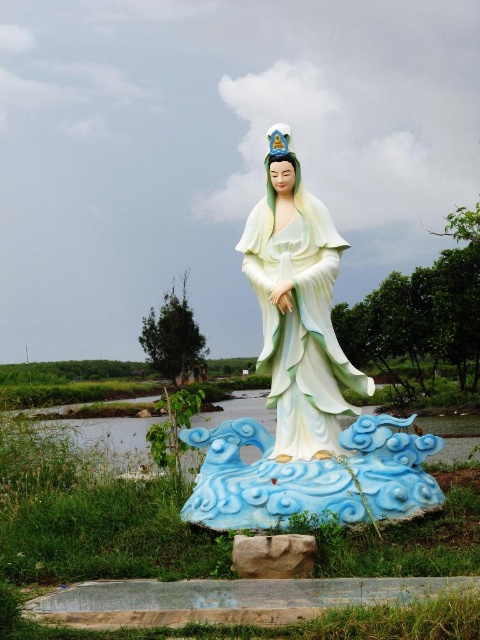
Question: Which point appears farthest from the camera in this image?

Choices:
 (A) (340, 253)
 (B) (183, 508)

Answer: (A)

Question: From the image, what is the correct spatial relationship of white glossy statue at center in relation to matte porcelain statue at center?

Choices:
 (A) right
 (B) left

Answer: (B)

Question: Can you confirm if white glossy statue at center is smaller than matte porcelain statue at center?

Choices:
 (A) no
 (B) yes

Answer: (A)

Question: Is white glossy statue at center below matte porcelain statue at center?

Choices:
 (A) yes
 (B) no

Answer: (A)